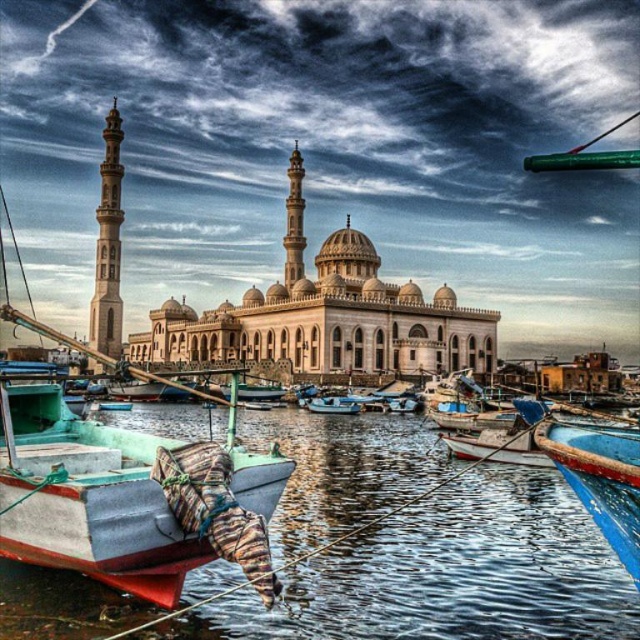
You are a photographer planning to capture the mosque and the boats in one shot. Based on the scene, which object, the smooth water at lower center or the teal matte boat at center, will appear closer to the camera in the photograph?

The teal matte boat at center will appear closer to the camera because it is taller than the smooth water at lower center, making it more prominent in the foreground.

You are standing at the point labeled as point (449, 573) in the image. Looking around, you see smooth water at lower center. What is the immediate surface you are standing on?

The point (449, 573) is on smooth water at lower center, so you are standing on smooth water at lower center.